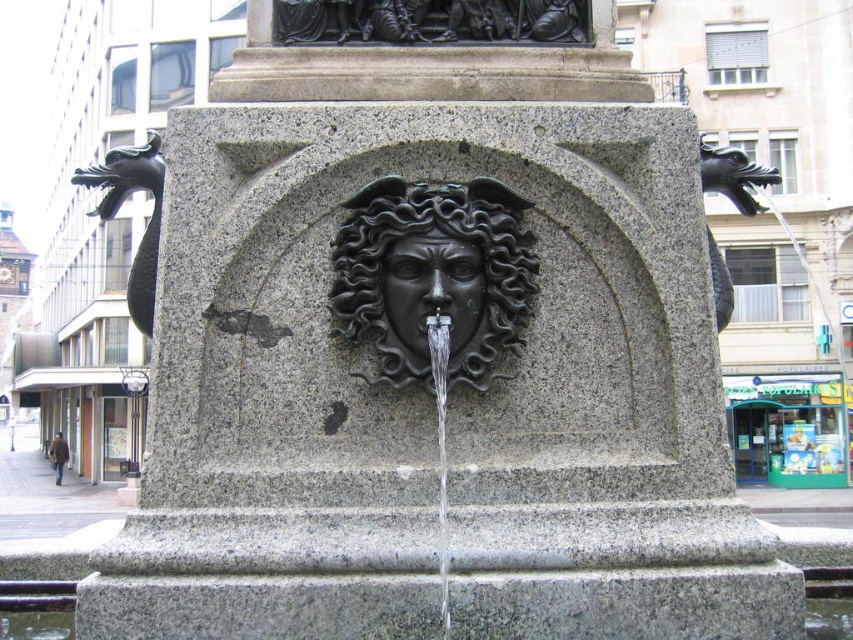
Which is more to the right, black polished stone lion at center or black polished stone face at center?

From the viewer's perspective, black polished stone face at center appears more on the right side.

At what (x,y) coordinates should I click in order to perform the action: click on black polished stone lion at center. Please return your answer as a coordinate pair (x, y). Looking at the image, I should click on (434, 276).